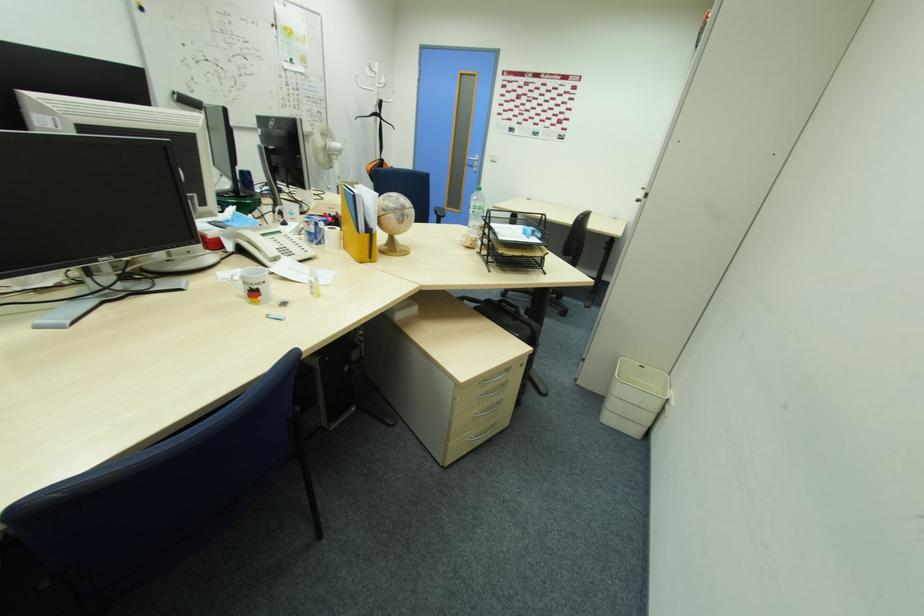
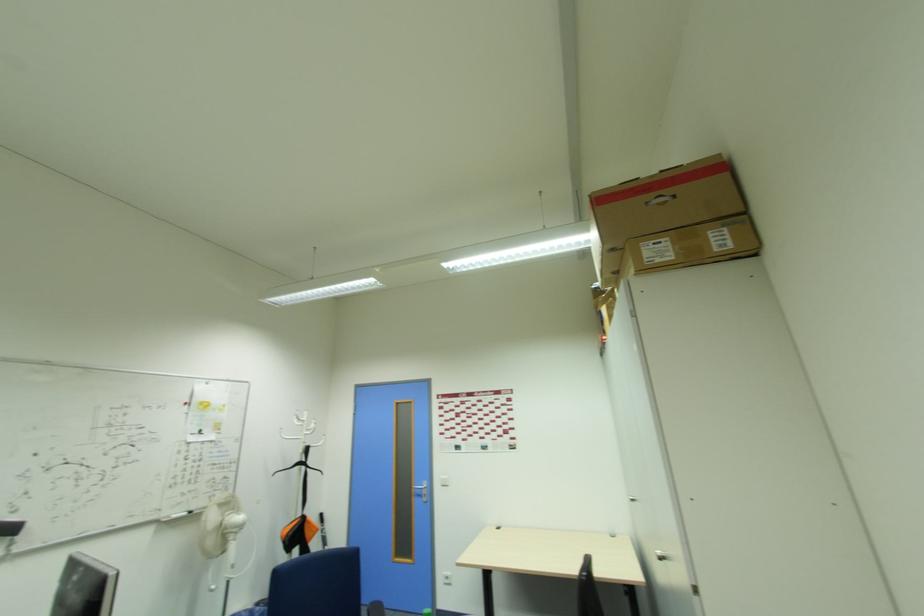
In the second image, find the point that corresponds to (476,159) in the first image.

(421, 485)